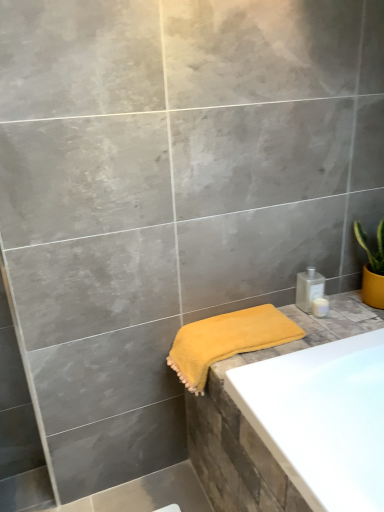
You are a GUI agent. You are given a task and a screenshot of the screen. Output one action in this format:
    pyautogui.click(x=<x>, y=<y>)
    Task: Click on the satin silver bottle at right, the first toiletry in the top-to-bottom sequence
    
    Given the screenshot: What is the action you would take?
    pyautogui.click(x=309, y=288)

The height and width of the screenshot is (512, 384). What do you see at coordinates (227, 341) in the screenshot?
I see `yellow soft towel at lower right` at bounding box center [227, 341].

Where is `yellow soft towel at lower right`? yellow soft towel at lower right is located at coordinates pos(227,341).

Locate an element on the screen. This screenshot has width=384, height=512. satin silver bottle at right, the first toiletry in the top-to-bottom sequence is located at coordinates (309, 288).

Is white glossy soap dispenser at upper right, the second toiletry positioned from the top, surrounded by yellow soft towel at lower right?

No.

Does yellow soft towel at lower right have a lesser height compared to white glossy soap dispenser at upper right, the first toiletry when ordered from bottom to top?

In fact, yellow soft towel at lower right may be taller than white glossy soap dispenser at upper right, the first toiletry when ordered from bottom to top.

Based on their positions, is yellow soft towel at lower right located to the left or right of white glossy soap dispenser at upper right, the second toiletry positioned from the top?

Clearly, yellow soft towel at lower right is on the left of white glossy soap dispenser at upper right, the second toiletry positioned from the top, in the image.

Considering the relative positions of white glossy soap dispenser at upper right, the first toiletry when ordered from bottom to top, and satin silver bottle at right, the first toiletry in the top-to-bottom sequence, in the image provided, is white glossy soap dispenser at upper right, the first toiletry when ordered from bottom to top, to the left or to the right of satin silver bottle at right, the first toiletry in the top-to-bottom sequence,?

Based on their positions, white glossy soap dispenser at upper right, the first toiletry when ordered from bottom to top, is located to the right of satin silver bottle at right, the first toiletry in the top-to-bottom sequence.

Is white glossy soap dispenser at upper right, the second toiletry positioned from the top, facing away from satin silver bottle at right, the first toiletry in the top-to-bottom sequence?

Yes, satin silver bottle at right, the first toiletry in the top-to-bottom sequence, is at the back of white glossy soap dispenser at upper right, the second toiletry positioned from the top.

How many degrees apart are the facing directions of white glossy soap dispenser at upper right, the first toiletry when ordered from bottom to top, and satin silver bottle at right, the first toiletry in the top-to-bottom sequence?

1.29 degrees separate the facing orientations of white glossy soap dispenser at upper right, the first toiletry when ordered from bottom to top, and satin silver bottle at right, the first toiletry in the top-to-bottom sequence.

From the image's perspective, which is above, white glossy soap dispenser at upper right, the first toiletry when ordered from bottom to top, or satin silver bottle at right, the 2th toiletry when ordered from bottom to top?

satin silver bottle at right, the 2th toiletry when ordered from bottom to top, from the image's perspective.

The width and height of the screenshot is (384, 512). In order to click on toiletry behind the white glossy soap dispenser at upper right, the second toiletry positioned from the top in this screenshot , I will do `click(309, 288)`.

Is satin silver bottle at right, the first toiletry in the top-to-bottom sequence, placed right next to white glossy soap dispenser at upper right, the second toiletry positioned from the top?

Yes, satin silver bottle at right, the first toiletry in the top-to-bottom sequence, is with white glossy soap dispenser at upper right, the second toiletry positioned from the top.

Can white glossy soap dispenser at upper right, the second toiletry positioned from the top, be found inside satin silver bottle at right, the first toiletry in the top-to-bottom sequence?

No, white glossy soap dispenser at upper right, the second toiletry positioned from the top, is not surrounded by satin silver bottle at right, the first toiletry in the top-to-bottom sequence.

Which object is positioned more to the right, satin silver bottle at right, the first toiletry in the top-to-bottom sequence, or white glossy soap dispenser at upper right, the first toiletry when ordered from bottom to top?

Positioned to the right is white glossy soap dispenser at upper right, the first toiletry when ordered from bottom to top.

Which object is wider, white glossy soap dispenser at upper right, the first toiletry when ordered from bottom to top, or yellow soft towel at lower right?

Wider between the two is yellow soft towel at lower right.

From the image's perspective, is white glossy soap dispenser at upper right, the first toiletry when ordered from bottom to top, over yellow soft towel at lower right?

Yes.

Is white glossy soap dispenser at upper right, the first toiletry when ordered from bottom to top, inside or outside of yellow soft towel at lower right?

white glossy soap dispenser at upper right, the first toiletry when ordered from bottom to top, is spatially situated outside yellow soft towel at lower right.

From a real-world perspective, who is located higher, white glossy soap dispenser at upper right, the second toiletry positioned from the top, or yellow soft towel at lower right?

From a 3D spatial view, white glossy soap dispenser at upper right, the second toiletry positioned from the top, is above.

Does satin silver bottle at right, the first toiletry in the top-to-bottom sequence, have a lesser height compared to yellow soft towel at lower right?

Yes, satin silver bottle at right, the first toiletry in the top-to-bottom sequence, is shorter than yellow soft towel at lower right.

From the image's perspective, is satin silver bottle at right, the 2th toiletry when ordered from bottom to top, located above or below yellow soft towel at lower right?

Clearly, from the image's perspective, satin silver bottle at right, the 2th toiletry when ordered from bottom to top, is above yellow soft towel at lower right.

How far apart are satin silver bottle at right, the first toiletry in the top-to-bottom sequence, and yellow soft towel at lower right?

satin silver bottle at right, the first toiletry in the top-to-bottom sequence, and yellow soft towel at lower right are 27.17 centimeters apart from each other.

Is satin silver bottle at right, the 2th toiletry when ordered from bottom to top, with yellow soft towel at lower right?

No, satin silver bottle at right, the 2th toiletry when ordered from bottom to top, is not making contact with yellow soft towel at lower right.

From a real-world perspective, who is located lower, yellow soft towel at lower right or satin silver bottle at right, the 2th toiletry when ordered from bottom to top?

From a 3D spatial view, yellow soft towel at lower right is below.

Relative to satin silver bottle at right, the first toiletry in the top-to-bottom sequence, is yellow soft towel at lower right in front or behind?

yellow soft towel at lower right is positioned closer to the viewer than satin silver bottle at right, the first toiletry in the top-to-bottom sequence.

Locate an element on the screen. The image size is (384, 512). towel below the satin silver bottle at right, the first toiletry in the top-to-bottom sequence (from the image's perspective) is located at coordinates (227, 341).

Between yellow soft towel at lower right and satin silver bottle at right, the 2th toiletry when ordered from bottom to top, which one appears on the left side from the viewer's perspective?

Positioned to the left is yellow soft towel at lower right.

Where is `the 1st toiletry above when counting from the yellow soft towel at lower right (from the image's perspective)`? The height and width of the screenshot is (512, 384). the 1st toiletry above when counting from the yellow soft towel at lower right (from the image's perspective) is located at coordinates (320, 307).

You are a GUI agent. You are given a task and a screenshot of the screen. Output one action in this format:
    pyautogui.click(x=<x>, y=<y>)
    Task: Click on the toiletry above the white glossy soap dispenser at upper right, the first toiletry when ordered from bottom to top (from a real-world perspective)
    
    Given the screenshot: What is the action you would take?
    pyautogui.click(x=309, y=288)

Considering their positions, is satin silver bottle at right, the first toiletry in the top-to-bottom sequence, positioned further to yellow soft towel at lower right than white glossy soap dispenser at upper right, the first toiletry when ordered from bottom to top?

white glossy soap dispenser at upper right, the first toiletry when ordered from bottom to top, is positioned further to the anchor yellow soft towel at lower right.

Which object lies nearer to the anchor point white glossy soap dispenser at upper right, the second toiletry positioned from the top, yellow soft towel at lower right or satin silver bottle at right, the first toiletry in the top-to-bottom sequence?

satin silver bottle at right, the first toiletry in the top-to-bottom sequence, lies closer to white glossy soap dispenser at upper right, the second toiletry positioned from the top, than the other object.

Looking at this image, considering their positions, is yellow soft towel at lower right positioned closer to satin silver bottle at right, the 2th toiletry when ordered from bottom to top, than white glossy soap dispenser at upper right, the second toiletry positioned from the top?

Based on the image, white glossy soap dispenser at upper right, the second toiletry positioned from the top, appears to be nearer to satin silver bottle at right, the 2th toiletry when ordered from bottom to top.

Consider the image. Estimate the real-world distances between objects in this image. Which object is closer to yellow soft towel at lower right, white glossy soap dispenser at upper right, the first toiletry when ordered from bottom to top, or satin silver bottle at right, the first toiletry in the top-to-bottom sequence?

Based on the image, satin silver bottle at right, the first toiletry in the top-to-bottom sequence, appears to be nearer to yellow soft towel at lower right.

Looking at the image, which one is located closer to white glossy soap dispenser at upper right, the second toiletry positioned from the top, satin silver bottle at right, the 2th toiletry when ordered from bottom to top, or yellow soft towel at lower right?

satin silver bottle at right, the 2th toiletry when ordered from bottom to top, is closer to white glossy soap dispenser at upper right, the second toiletry positioned from the top.

Which object lies further to the anchor point satin silver bottle at right, the first toiletry in the top-to-bottom sequence, white glossy soap dispenser at upper right, the second toiletry positioned from the top, or yellow soft towel at lower right?

yellow soft towel at lower right.

You are a GUI agent. You are given a task and a screenshot of the screen. Output one action in this format:
    pyautogui.click(x=<x>, y=<y>)
    Task: Click on the toiletry situated between yellow soft towel at lower right and white glossy soap dispenser at upper right, the second toiletry positioned from the top, from left to right
    This screenshot has width=384, height=512.
    Given the screenshot: What is the action you would take?
    [309, 288]